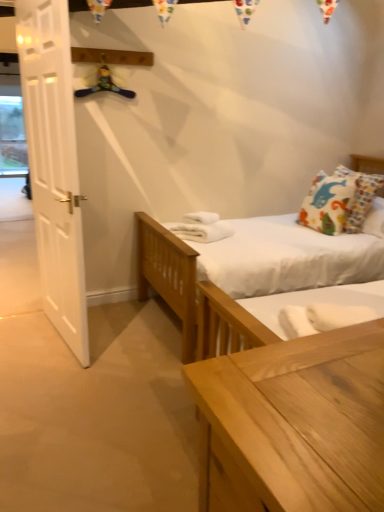
Question: Is yellow fabric hanger at upper center inside or outside of white wooden door at left?

Choices:
 (A) outside
 (B) inside

Answer: (A)

Question: Based on their sizes in the image, would you say yellow fabric hanger at upper center is bigger or smaller than white wooden door at left?

Choices:
 (A) small
 (B) big

Answer: (A)

Question: Estimate the real-world distances between objects in this image. Which object is farther from the printed fabric pillow at upper right?

Choices:
 (A) white wooden door at left
 (B) yellow fabric hanger at upper center

Answer: (A)

Question: Which is farther from the white wooden door at left?

Choices:
 (A) yellow fabric hanger at upper center
 (B) printed fabric pillow at upper right

Answer: (B)